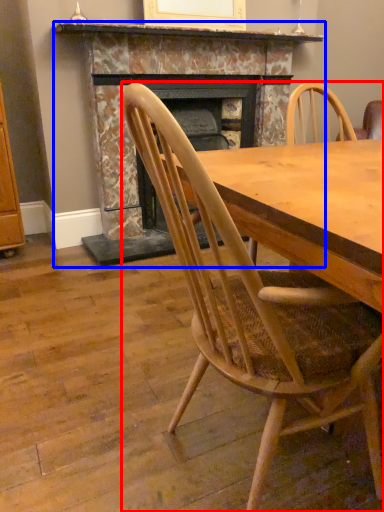
Question: Which object appears farthest to the camera in this image, chair (highlighted by a red box) or fireplace (highlighted by a blue box)?

Choices:
 (A) chair
 (B) fireplace

Answer: (B)